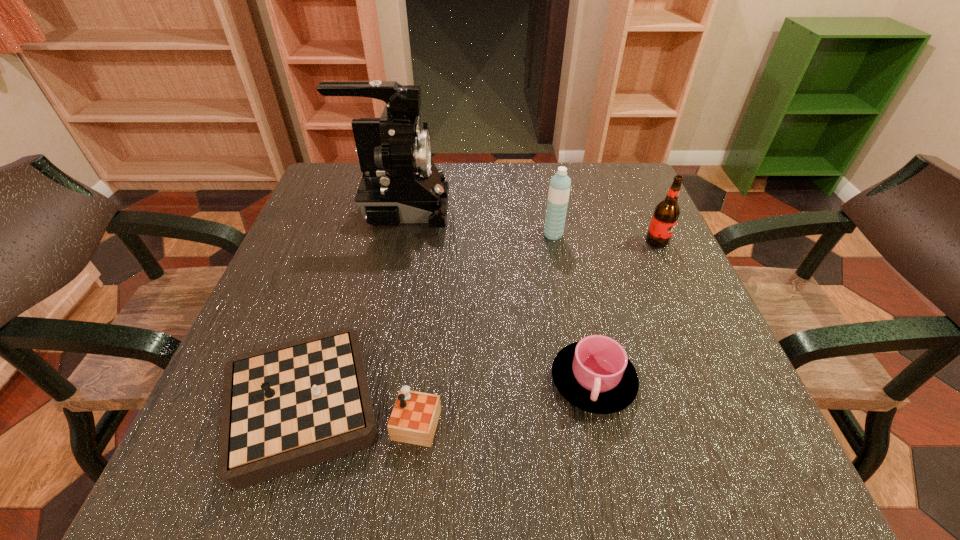
Locate an element on the screen. This screenshot has width=960, height=540. camcorder is located at coordinates (400, 183).

At what (x,y) coordinates should I click in order to perform the action: click on water bottle. Please return your answer as a coordinate pair (x, y). This screenshot has height=540, width=960. Looking at the image, I should click on [x=559, y=189].

At what (x,y) coordinates should I click in order to perform the action: click on root beer. Please return your answer as a coordinate pair (x, y). The image size is (960, 540). Looking at the image, I should click on (666, 213).

The image size is (960, 540). Find the location of `cup`. cup is located at coordinates (595, 375).

Locate an element on the screen. The width and height of the screenshot is (960, 540). chessboard is located at coordinates (289, 406).

Identify the location of vacant space located 0.340m on the lens mount of the tallest object. Image resolution: width=960 pixels, height=540 pixels. (591, 208).

Find the location of `blank space located 0.100m on the right of the water bottle`. blank space located 0.100m on the right of the water bottle is located at coordinates pos(608,234).

This screenshot has width=960, height=540. In order to click on free space located 0.060m on the left of the rightmost object in this screenshot , I will do `click(618, 241)`.

Locate an element on the screen. The width and height of the screenshot is (960, 540). vacant space situated on the side with the handle of the cup is located at coordinates (610, 459).

The image size is (960, 540). I want to click on free space located 0.350m on the back of the chessboard, so click(380, 220).